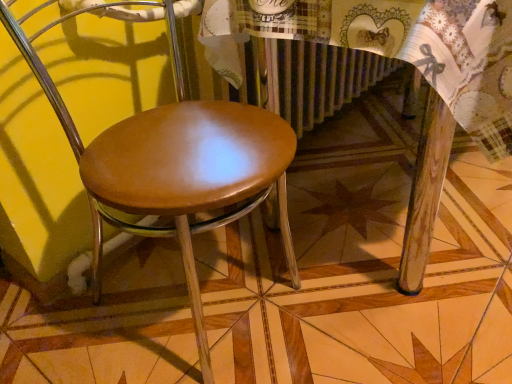
The width and height of the screenshot is (512, 384). What do you see at coordinates (175, 166) in the screenshot? I see `shiny brown wood chair at center` at bounding box center [175, 166].

Locate an element on the screen. The width and height of the screenshot is (512, 384). shiny brown wood chair at center is located at coordinates (175, 166).

Where is `wooden table at center`? This screenshot has width=512, height=384. wooden table at center is located at coordinates (416, 71).

The width and height of the screenshot is (512, 384). What do you see at coordinates (416, 71) in the screenshot?
I see `wooden table at center` at bounding box center [416, 71].

In the scene shown: In order to face wooden table at center, should I rotate leftwards or rightwards?

Rotate your view right by about 21.500°.

Where is `shiny brown wood chair at center`? shiny brown wood chair at center is located at coordinates (175, 166).

Based on the photo, visually, is shiny brown wood chair at center positioned to the left or to the right of wooden table at center?

shiny brown wood chair at center is to the left of wooden table at center.

In the image, is shiny brown wood chair at center positioned in front of or behind wooden table at center?

shiny brown wood chair at center is positioned closer to the viewer than wooden table at center.

Is point (132, 229) closer or farther from the camera than point (246, 14)?

Point (132, 229) appears to be farther away from the viewer than point (246, 14).

From the image's perspective, is shiny brown wood chair at center above or below wooden table at center?

From the image's perspective, shiny brown wood chair at center appears below wooden table at center.

From a real-world perspective, which is physically above, shiny brown wood chair at center or wooden table at center?

From a 3D spatial view, shiny brown wood chair at center is above.

Can you confirm if shiny brown wood chair at center is wider than wooden table at center?

In fact, shiny brown wood chair at center might be narrower than wooden table at center.

Is shiny brown wood chair at center taller than wooden table at center?

Indeed, shiny brown wood chair at center has a greater height compared to wooden table at center.

Does shiny brown wood chair at center have a smaller size compared to wooden table at center?

Correct, shiny brown wood chair at center occupies less space than wooden table at center.

Could wooden table at center be considered to be inside shiny brown wood chair at center?

No, shiny brown wood chair at center does not contain wooden table at center.

Is shiny brown wood chair at center not close to wooden table at center?

No, shiny brown wood chair at center is in close proximity to wooden table at center.

Is shiny brown wood chair at center facing away from wooden table at center?

No, wooden table at center is not at the back of shiny brown wood chair at center.

Can you tell me how much shiny brown wood chair at center and wooden table at center differ in facing direction?

The angular difference between shiny brown wood chair at center and wooden table at center is 0.000132 degrees.

Locate an element on the screen. chair below the wooden table at center (from the image's perspective) is located at coordinates (175, 166).

Considering the relative positions of wooden table at center and shiny brown wood chair at center in the image provided, is wooden table at center to the right of shiny brown wood chair at center from the viewer's perspective?

Yes, wooden table at center is to the right of shiny brown wood chair at center.

Is wooden table at center positioned before shiny brown wood chair at center?

No, it is not.

Which is in front, point (383, 41) or point (214, 226)?

The point (383, 41) is closer to the camera.

From the image's perspective, between wooden table at center and shiny brown wood chair at center, who is located below?

shiny brown wood chair at center appears lower in the image.

From a real-world perspective, does wooden table at center sit lower than shiny brown wood chair at center?

Yes, from a real-world perspective, wooden table at center is under shiny brown wood chair at center.

Is wooden table at center thinner than shiny brown wood chair at center?

No, wooden table at center is not thinner than shiny brown wood chair at center.

Who is taller, wooden table at center or shiny brown wood chair at center?

Standing taller between the two is shiny brown wood chair at center.

Between wooden table at center and shiny brown wood chair at center, which one has smaller size?

shiny brown wood chair at center is smaller.

Based on the photo, is wooden table at center inside the boundaries of shiny brown wood chair at center, or outside?

wooden table at center is not inside shiny brown wood chair at center, it's outside.

Is wooden table at center far away from shiny brown wood chair at center?

No, wooden table at center is not far away from shiny brown wood chair at center.

Is wooden table at center oriented away from shiny brown wood chair at center?

No, shiny brown wood chair at center is not at the back of wooden table at center.

Locate an element on the screen. chair on the left of the wooden table at center is located at coordinates (175, 166).

This screenshot has width=512, height=384. Find the location of `chair on the left of wooden table at center`. chair on the left of wooden table at center is located at coordinates (175, 166).

I want to click on round table lying behind the shiny brown wood chair at center, so click(416, 71).